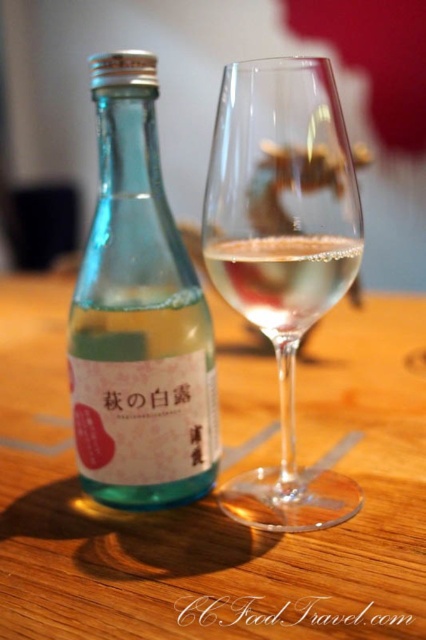
Question: Is clear glass wine glass at center to the left of transparent glass at upper center from the viewer's perspective?

Choices:
 (A) no
 (B) yes

Answer: (A)

Question: Which object appears closest to the camera in this image?

Choices:
 (A) transparent glass at upper center
 (B) clear glass wine at center
 (C) transparent glass bottle at left

Answer: (B)

Question: Considering the real-world distances, which object is farthest from the transparent glass bottle at left?

Choices:
 (A) clear glass wine at center
 (B) clear glass wine glass at center
 (C) transparent glass at upper center
 (D) wooden table at center

Answer: (D)

Question: Which point is closer to the camera?

Choices:
 (A) (42, 412)
 (B) (189, 385)
 (C) (301, 266)
 (D) (339, 275)

Answer: (C)

Question: Is the position of clear glass wine glass at center more distant than that of clear glass wine at center?

Choices:
 (A) no
 (B) yes

Answer: (A)

Question: Can you confirm if wooden table at center is positioned to the left of transparent glass at upper center?

Choices:
 (A) yes
 (B) no

Answer: (B)